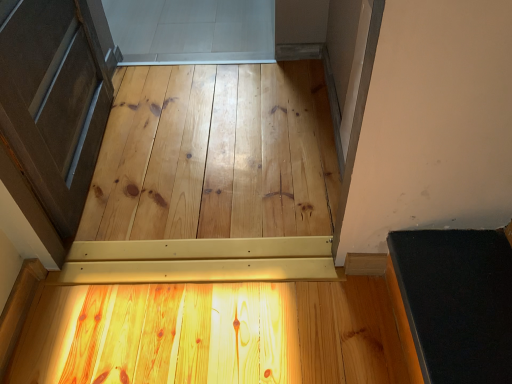
Question: Does natural wood plywood at center, the first plywood when ordered from back to front, have a smaller size compared to light brown polished wood at center, the 1th plywood when ordered from bottom to top?

Choices:
 (A) yes
 (B) no

Answer: (B)

Question: Is natural wood plywood at center, marked as the second plywood in a bottom-to-top arrangement, looking in the opposite direction of light brown polished wood at center, the 1th plywood when ordered from bottom to top?

Choices:
 (A) no
 (B) yes

Answer: (B)

Question: From the image's perspective, is natural wood plywood at center, the first plywood when ordered from back to front, above light brown polished wood at center, the 1th plywood when ordered from bottom to top?

Choices:
 (A) no
 (B) yes

Answer: (B)

Question: From the image's perspective, would you say natural wood plywood at center, which is the 1th plywood from top to bottom, is shown under light brown polished wood at center, which is counted as the 2th plywood, starting from the back?

Choices:
 (A) yes
 (B) no

Answer: (B)

Question: From a real-world perspective, is natural wood plywood at center, which is the second plywood from front to back, positioned under light brown polished wood at center, the 1th plywood when ordered from bottom to top, based on gravity?

Choices:
 (A) no
 (B) yes

Answer: (B)

Question: Would you say natural wood plywood at center, which is the 1th plywood from top to bottom, is outside light brown polished wood at center, which is counted as the 2th plywood, starting from the back?

Choices:
 (A) no
 (B) yes

Answer: (B)

Question: Is light brown polished wood at center, the 1th plywood when ordered from bottom to top, at the left side of natural wood plywood at center, which is the 1th plywood from top to bottom?

Choices:
 (A) no
 (B) yes

Answer: (A)

Question: From a real-world perspective, is light brown polished wood at center, the first plywood in the front-to-back sequence, positioned under natural wood plywood at center, which is the 1th plywood from top to bottom, based on gravity?

Choices:
 (A) yes
 (B) no

Answer: (B)

Question: Is light brown polished wood at center, which is counted as the 2th plywood, starting from the back, looking in the opposite direction of natural wood plywood at center, which is the 1th plywood from top to bottom?

Choices:
 (A) yes
 (B) no

Answer: (B)

Question: Is light brown polished wood at center, the 1th plywood when ordered from bottom to top, beside natural wood plywood at center, which is the second plywood from front to back?

Choices:
 (A) no
 (B) yes

Answer: (A)

Question: Is light brown polished wood at center, the first plywood in the front-to-back sequence, smaller than natural wood plywood at center, which is the second plywood from front to back?

Choices:
 (A) no
 (B) yes

Answer: (B)

Question: Does light brown polished wood at center, the 1th plywood when ordered from bottom to top, have a greater width compared to natural wood plywood at center, the first plywood when ordered from back to front?

Choices:
 (A) yes
 (B) no

Answer: (B)

Question: Considering the positions of natural wood plywood at center, the first plywood when ordered from back to front, and light brown polished wood at center, the 1th plywood when ordered from bottom to top, in the image, is natural wood plywood at center, the first plywood when ordered from back to front, bigger or smaller than light brown polished wood at center, the 1th plywood when ordered from bottom to top,?

Choices:
 (A) small
 (B) big

Answer: (B)